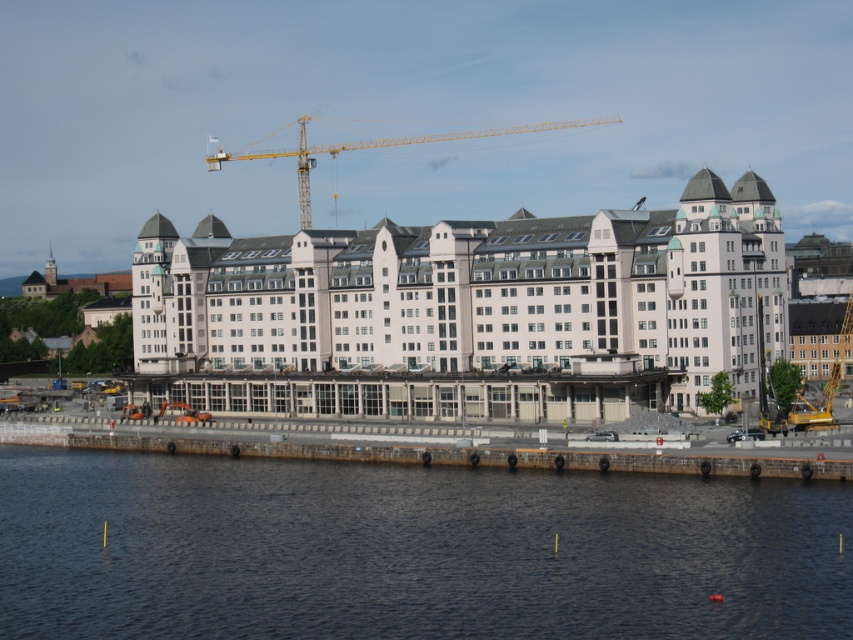
You are standing at the waterfront and see the dark blue water at lower center and the white smooth building at center. Which object is closer to the ground level?

The dark blue water at lower center is closer to the ground level because it is positioned below the white smooth building at center.

From the picture: You are standing at the entrance of the building and want to reach the dark blue water at lower center. Which direction should you walk to get there?

The dark blue water at lower center is located at point (410, 550) in the image, so you should walk towards the lower center direction to reach it.